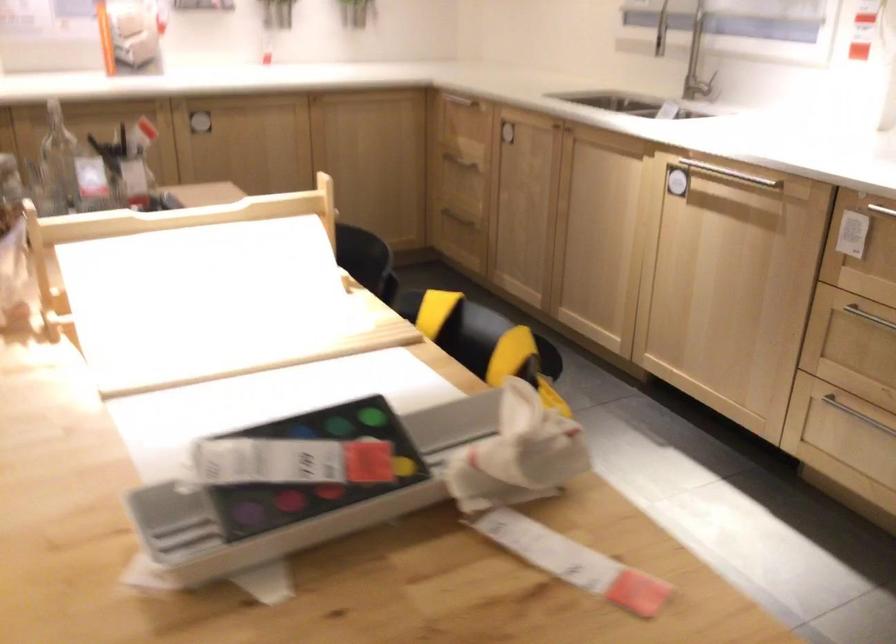
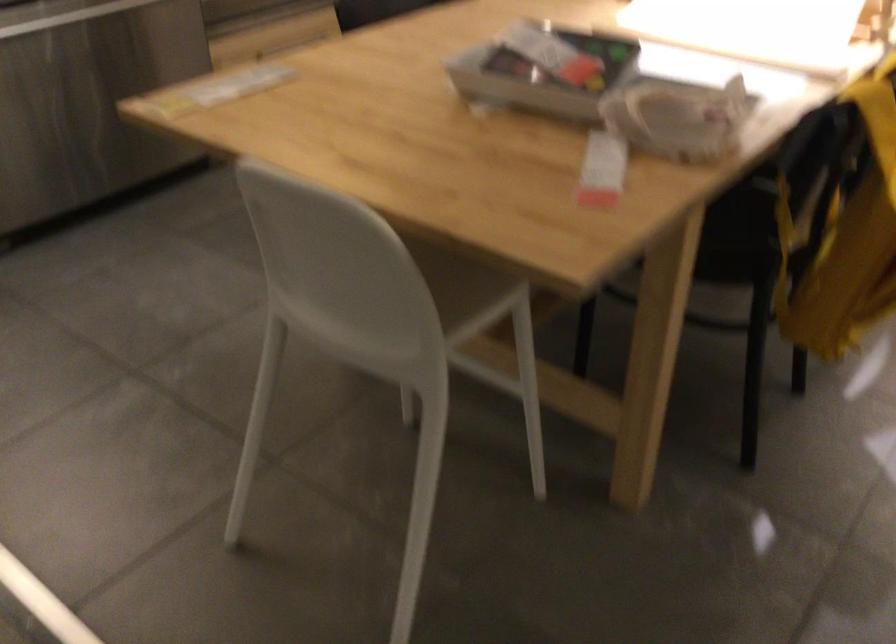
Find the pixel in the second image that matches [488,462] in the first image.

(677, 117)